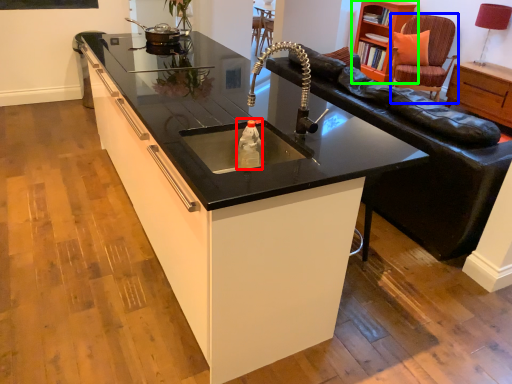
Question: Based on their relative distances, which object is farther from bottle (highlighted by a red box)? Choose from swivel chair (highlighted by a blue box) and cabinetry (highlighted by a green box).

Choices:
 (A) swivel chair
 (B) cabinetry

Answer: (A)